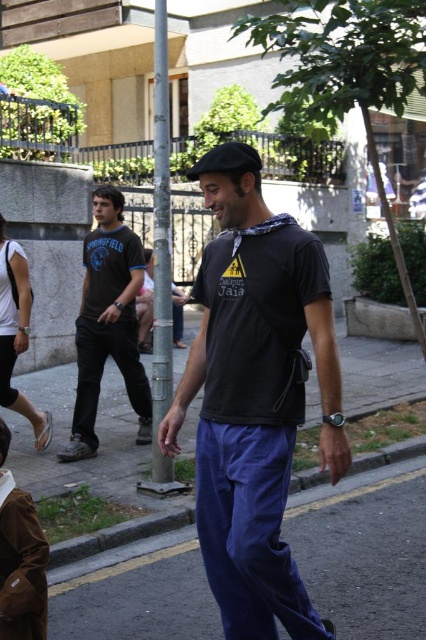
Between black cotton t-shirt at center and black fabric baseball hat at center, which one appears on the right side from the viewer's perspective?

Positioned to the right is black cotton t-shirt at center.

Image resolution: width=426 pixels, height=640 pixels. In order to click on black cotton t-shirt at center in this screenshot , I will do `click(256, 403)`.

Where is `black cotton t-shirt at center`? black cotton t-shirt at center is located at coordinates (256, 403).

Is blue fabric pants at lower center to the right of matte black t-shirt at center from the viewer's perspective?

Correct, you'll find blue fabric pants at lower center to the right of matte black t-shirt at center.

Between point (172, 609) and point (124, 230), which one is positioned in front?

Positioned in front is point (172, 609).

You are a GUI agent. You are given a task and a screenshot of the screen. Output one action in this format:
    pyautogui.click(x=<x>, y=<y>)
    Task: Click on the blue fabric pants at lower center
    
    Given the screenshot: What is the action you would take?
    pyautogui.click(x=353, y=541)

Consider the image. Which of these two, black cotton t-shirt at center or blue fabric pants at lower center, stands shorter?

blue fabric pants at lower center

Can you confirm if black cotton t-shirt at center is shorter than blue fabric pants at lower center?

In fact, black cotton t-shirt at center may be taller than blue fabric pants at lower center.

At what (x,y) coordinates should I click in order to perform the action: click on black cotton t-shirt at center. Please return your answer as a coordinate pair (x, y). The width and height of the screenshot is (426, 640). Looking at the image, I should click on (256, 403).

Locate an element on the screen. black cotton t-shirt at center is located at coordinates (256, 403).